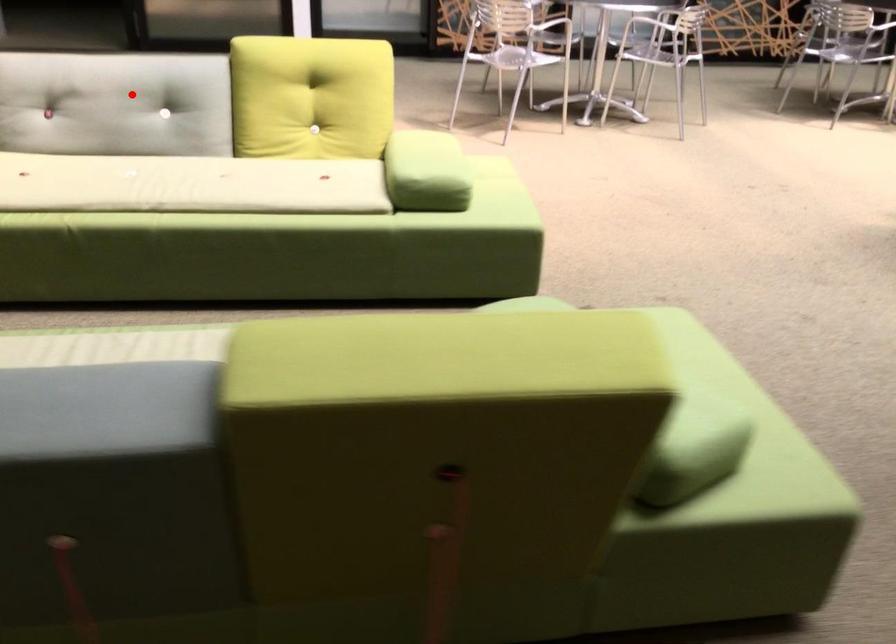
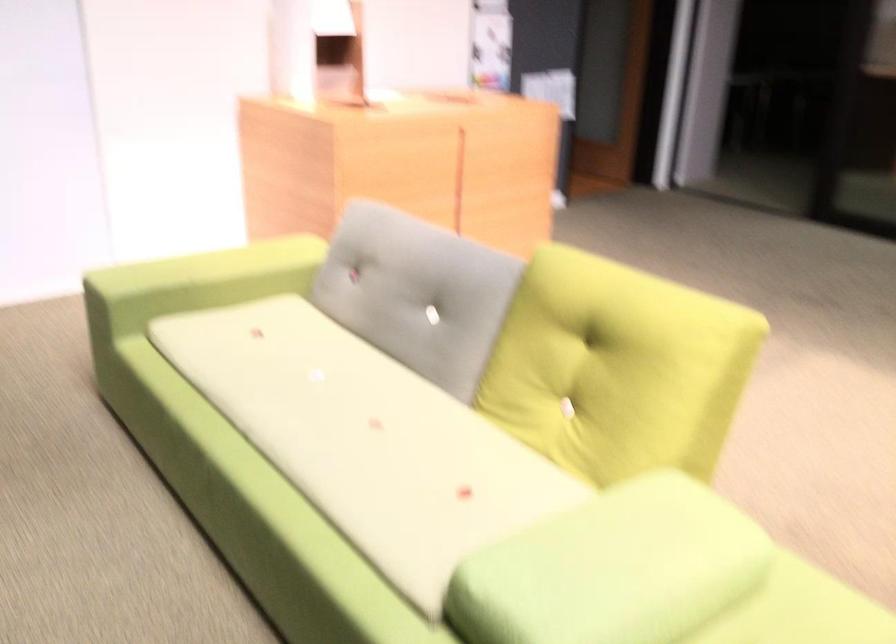
The point at the highlighted location is marked in the first image. Where is the corresponding point in the second image?

(417, 292)